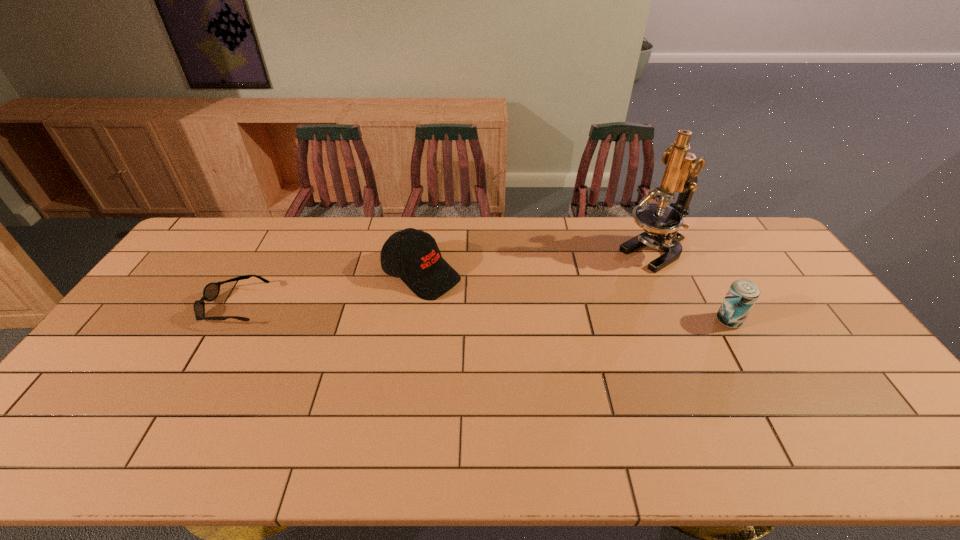
This screenshot has height=540, width=960. What are the coordinates of `object that is the second closest to the sunglasses` in the screenshot? It's located at (660, 222).

Locate which object is the third closest to the sunglasses. Please provide its 2D coordinates. Your answer should be formatted as a tuple, i.e. [(x, y)], where the tuple contains the x and y coordinates of a point satisfying the conditions above.

[(742, 294)]

Identify the location of free space in the image that satisfies the following two spatial constraints: 1. on the front side of the beer can; 2. on the right side of the baseball cap. This screenshot has height=540, width=960. [x=414, y=321].